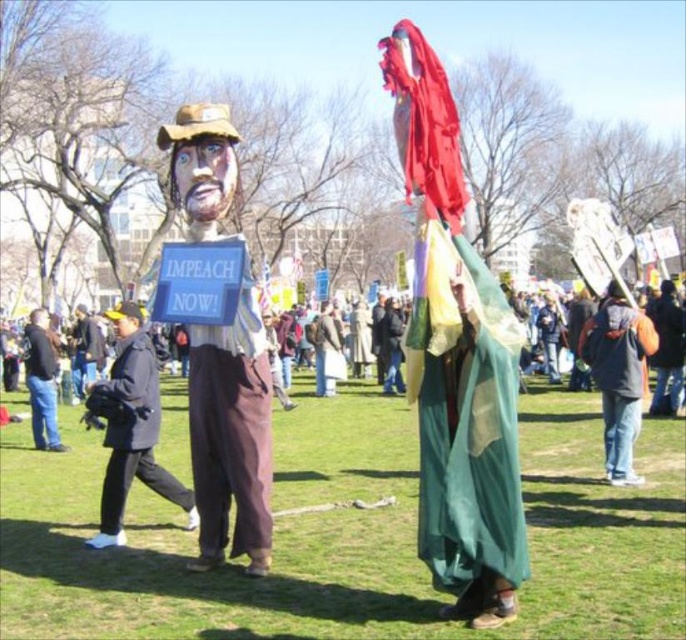
Question: Does matte cardboard figure at center lie in front of jeans at left?

Choices:
 (A) yes
 (B) no

Answer: (A)

Question: Among these points, which one is farthest from the camera?

Choices:
 (A) coord(239,426)
 (B) coord(38,445)
 (C) coord(82,394)
 (D) coord(141,364)

Answer: (C)

Question: Does matte cardboard figure at center lie in front of black fabric jacket at left?

Choices:
 (A) yes
 (B) no

Answer: (A)

Question: Among these points, which one is nearest to the camera?

Choices:
 (A) (80, 385)
 (B) (38, 333)

Answer: (B)

Question: In this image, where is black fabric jacket at left located relative to dark blue fabric at center?

Choices:
 (A) above
 (B) below

Answer: (B)

Question: Which object is the closest to the dark blue fabric at center?

Choices:
 (A) jeans at left
 (B) black fabric jacket at left

Answer: (A)